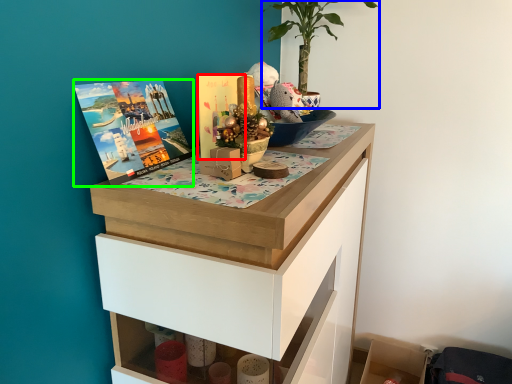
Question: Estimate the real-world distances between objects in this image. Which object is closer to book cover (highlighted by a red box), houseplant (highlighted by a blue box) or book cover (highlighted by a green box)?

Choices:
 (A) houseplant
 (B) book cover

Answer: (B)